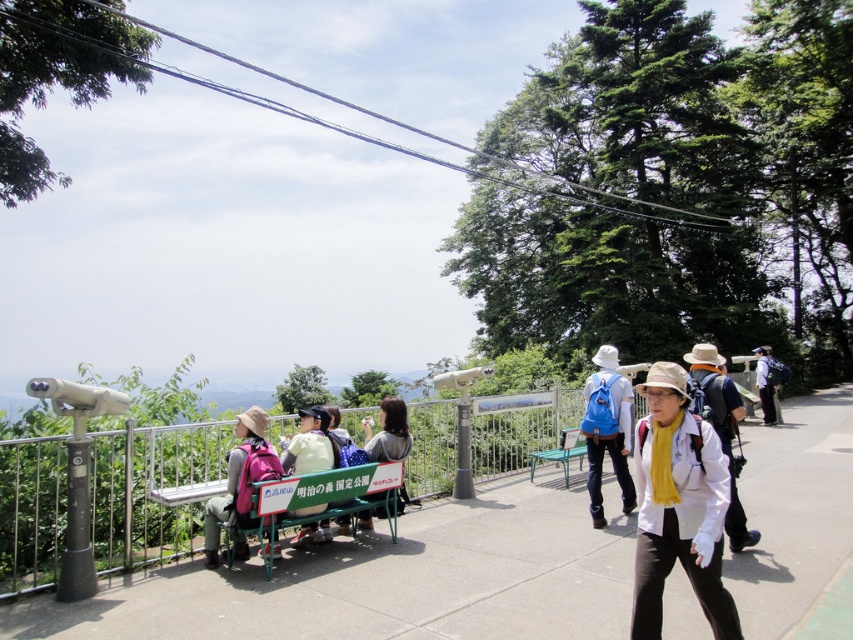
Question: Which point is farther to the camera?

Choices:
 (A) (769, 353)
 (B) (753, 532)
 (C) (297, 465)
 (D) (773, 417)

Answer: (A)

Question: Which point appears closest to the camera in this image?

Choices:
 (A) (769, 404)
 (B) (730, 419)

Answer: (B)

Question: Does gray concrete pavement at center have a smaller size compared to white matte hat at center?

Choices:
 (A) no
 (B) yes

Answer: (A)

Question: Which object appears closest to the camera in this image?

Choices:
 (A) matte black jacket at center
 (B) blue fabric backpack at center-right

Answer: (A)

Question: Does white matte hat at center appear on the right side of matte black jacket at center?

Choices:
 (A) yes
 (B) no

Answer: (A)

Question: Does matte pink backpack at center-left appear over light green plastic bench at center?

Choices:
 (A) yes
 (B) no

Answer: (B)